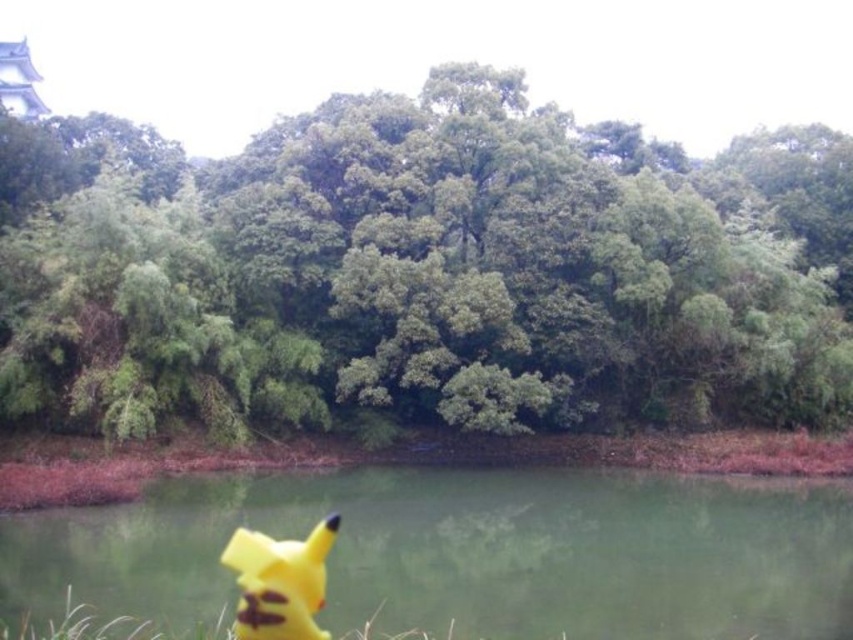
Does green leafy tree at center have a greater width compared to yellow fabric pikachu at lower center?

Correct, the width of green leafy tree at center exceeds that of yellow fabric pikachu at lower center.

In the scene shown: Which is more to the right, green leafy tree at center or yellow fabric pikachu at lower center?

yellow fabric pikachu at lower center

Image resolution: width=853 pixels, height=640 pixels. Describe the element at coordinates (405, 276) in the screenshot. I see `green leafy tree at center` at that location.

The image size is (853, 640). Identify the location of green leafy tree at center. (405, 276).

What are the coordinates of `yellow fabric pikachu at lower center` in the screenshot? It's located at (466, 552).

Who is more distant from viewer, (654, 483) or (260, 586)?

Positioned behind is point (654, 483).

What are the coordinates of `yellow fabric pikachu at lower center` in the screenshot? It's located at (466, 552).

Can you confirm if green leafy tree at center is positioned below yellow matte pikachu at lower left?

Actually, green leafy tree at center is above yellow matte pikachu at lower left.

Is point (730, 332) more distant than point (248, 541)?

That is True.

Locate an element on the screen. The image size is (853, 640). green leafy tree at center is located at coordinates (405, 276).